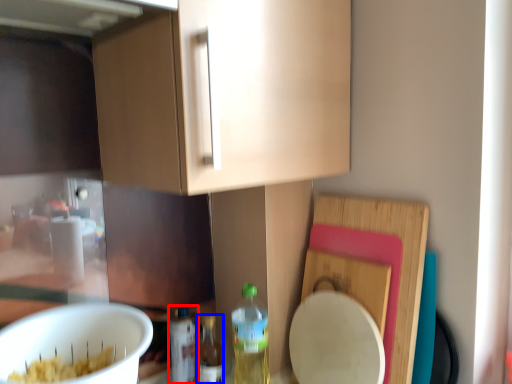
Question: Which object is closer to the camera taking this photo, bottle (highlighted by a red box) or bottle (highlighted by a blue box)?

Choices:
 (A) bottle
 (B) bottle

Answer: (B)